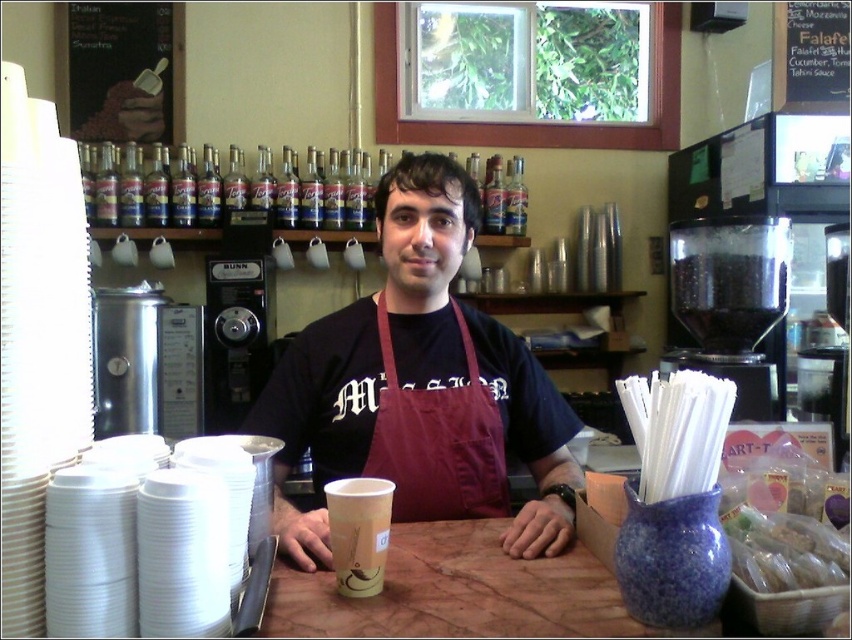
You are a customer in the coffee shop and want to place your order. You have a translucent plastic bag at lower right containing your belongings. Where should you place your bag so it doesn not obstruct the counter space? The options are either on the brown marble table at center or keep it on the counter.

You should place your translucent plastic bag at lower right on the brown marble table at center because the brown marble table at center is larger in size than the translucent plastic bag at lower right, providing more space to accommodate it without blocking the counter.

What are the coordinates of the brown marble table at center in the image?

The coordinates of the brown marble table at center are at point (459, 593).

You are a customer in the coffee shop and want to place your phone on the brown marble table at center. However, you notice the maroon apron at center is nearby. Is there enough space between them for your phone?

The maroon apron at center and brown marble table at center are 20.05 centimeters apart, so there is sufficient space to place your phone between them.